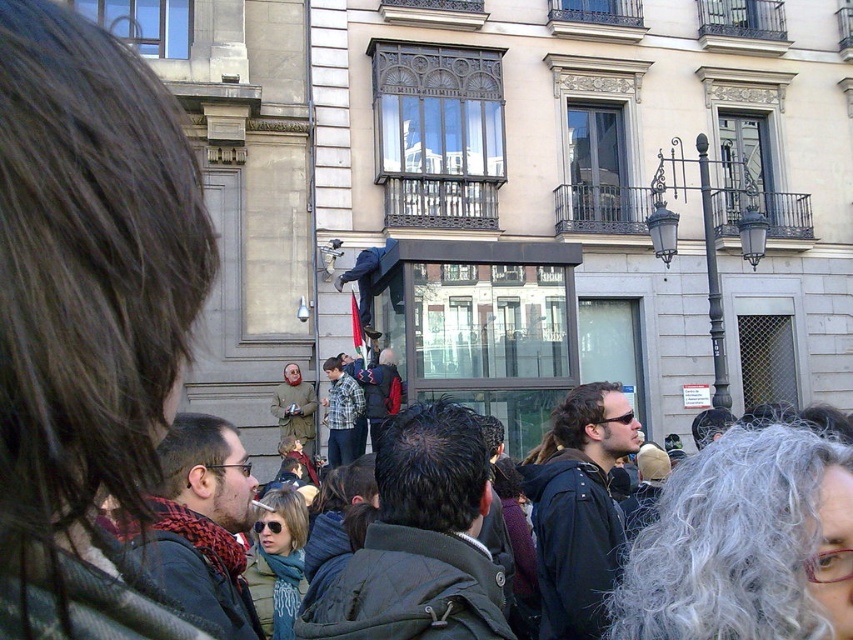
Can you confirm if dark gray jacket at center is shorter than red plaid scarf at lower left?

No, dark gray jacket at center is not shorter than red plaid scarf at lower left.

Who is lower down, dark gray jacket at center or red plaid scarf at lower left?

Positioned lower is dark gray jacket at center.

Between point (457, 412) and point (248, 518), which one is positioned behind?

Positioned behind is point (248, 518).

Where is `dark gray jacket at center`? This screenshot has width=853, height=640. dark gray jacket at center is located at coordinates (421, 540).

Who is lower down, red plaid scarf at lower left or checkered fabric shirt at center?

Positioned lower is red plaid scarf at lower left.

Locate an element on the screen. This screenshot has width=853, height=640. red plaid scarf at lower left is located at coordinates (202, 524).

Is point (184, 512) farther from camera compared to point (331, 420)?

No.

In order to click on red plaid scarf at lower left in this screenshot , I will do `click(202, 524)`.

Between dark gray jacket at center and dark blue jacket at center, which one has less height?

dark blue jacket at center is shorter.

Consider the image. Is dark gray jacket at center above dark blue jacket at center?

No.

Which is behind, point (450, 468) or point (369, 419)?

The point (369, 419) is more distant.

Identify the location of dark gray jacket at center. The width and height of the screenshot is (853, 640). (421, 540).